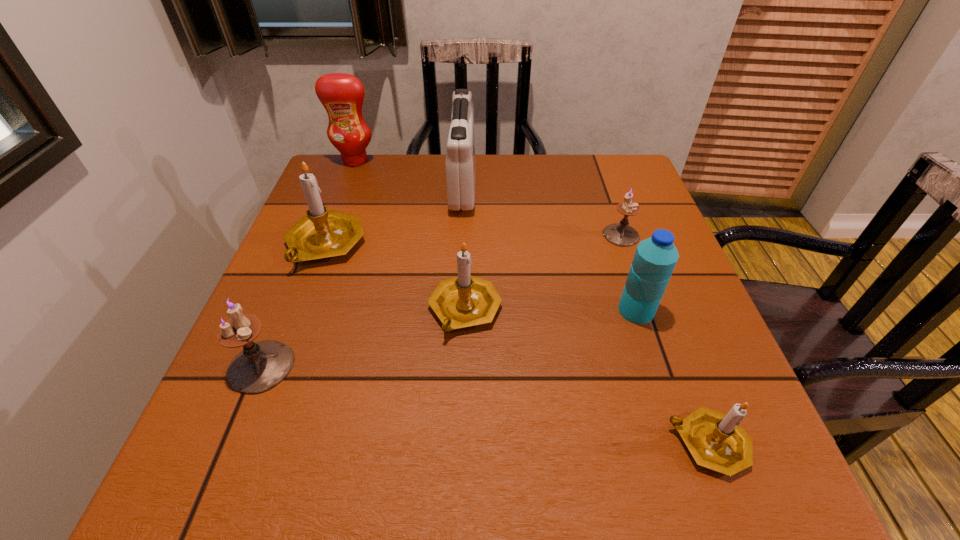
Locate an element on the screen. free area in between the farthest gold candle holder and the smaller purple candle holder is located at coordinates (473, 240).

This screenshot has width=960, height=540. What are the coordinates of `unoccupied position between the blue water bottle and the farther purple candle holder` in the screenshot? It's located at (629, 273).

At what (x,y) coordinates should I click in order to perform the action: click on free space between the biggest gold candle holder and the first-aid kit. Please return your answer as a coordinate pair (x, y). Looking at the image, I should click on (394, 215).

I want to click on object that stands as the third closest to the water bottle, so click(463, 301).

Where is `object that can be found as the second closest to the first-aid kit`? object that can be found as the second closest to the first-aid kit is located at coordinates (341, 94).

You are a GUI agent. You are given a task and a screenshot of the screen. Output one action in this format:
    pyautogui.click(x=<x>, y=<y>)
    Task: Click on the candle holder that stands as the closest to the bigger purple candle holder
    
    Given the screenshot: What is the action you would take?
    pyautogui.click(x=321, y=234)

Select which candle holder appears as the second closest to the red first-aid kit. Please provide its 2D coordinates. Your answer should be formatted as a tuple, i.e. [(x, y)], where the tuple contains the x and y coordinates of a point satisfying the conditions above.

[(463, 301)]

Where is `gold candle holder that is the third closest to the condiment`? Image resolution: width=960 pixels, height=540 pixels. gold candle holder that is the third closest to the condiment is located at coordinates (716, 440).

Point out which gold candle holder is positioned as the nearest to the nearest candle holder. Please provide its 2D coordinates. Your answer should be formatted as a tuple, i.e. [(x, y)], where the tuple contains the x and y coordinates of a point satisfying the conditions above.

[(463, 301)]

Where is `vacant space that satisfies the following two spatial constraints: 1. on the label side of the red condiment; 2. on the left side of the blue water bottle`? vacant space that satisfies the following two spatial constraints: 1. on the label side of the red condiment; 2. on the left side of the blue water bottle is located at coordinates (299, 310).